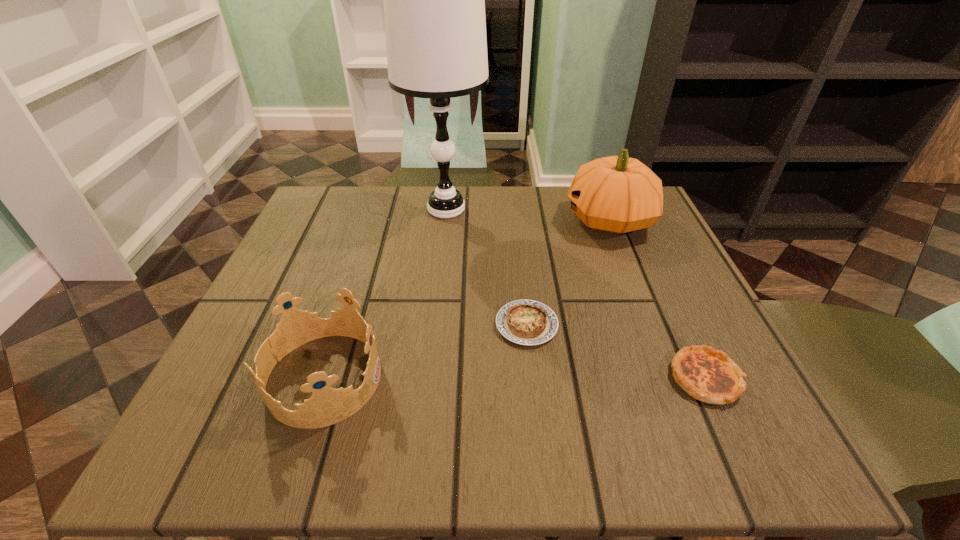
The width and height of the screenshot is (960, 540). I want to click on free space between the nearer quiche and the gourd, so click(658, 299).

This screenshot has height=540, width=960. What are the coordinates of `free space between the table lamp and the gourd` in the screenshot? It's located at (528, 214).

I want to click on vacant area that lies between the third object from left to right and the fourth shortest object, so click(x=568, y=272).

Image resolution: width=960 pixels, height=540 pixels. Find the location of `empty space that is in between the gourd and the nearer quiche`. empty space that is in between the gourd and the nearer quiche is located at coordinates (658, 299).

Where is `vacant area between the third tallest object and the left quiche`? The height and width of the screenshot is (540, 960). vacant area between the third tallest object and the left quiche is located at coordinates (425, 351).

Find the location of a particular element. Image resolution: width=960 pixels, height=540 pixels. free space that is in between the shorter quiche and the tallest object is located at coordinates (487, 267).

Where is `unoccupied area between the shortest object and the tallest object`? unoccupied area between the shortest object and the tallest object is located at coordinates (487, 267).

This screenshot has height=540, width=960. I want to click on free space between the second tallest object and the shortest object, so click(568, 272).

Identify which object is the third closest to the nearer quiche. Please provide its 2D coordinates. Your answer should be formatted as a tuple, i.e. [(x, y)], where the tuple contains the x and y coordinates of a point satisfying the conditions above.

[(434, 0)]

Where is `the third closest object relative to the tiara`? the third closest object relative to the tiara is located at coordinates (617, 194).